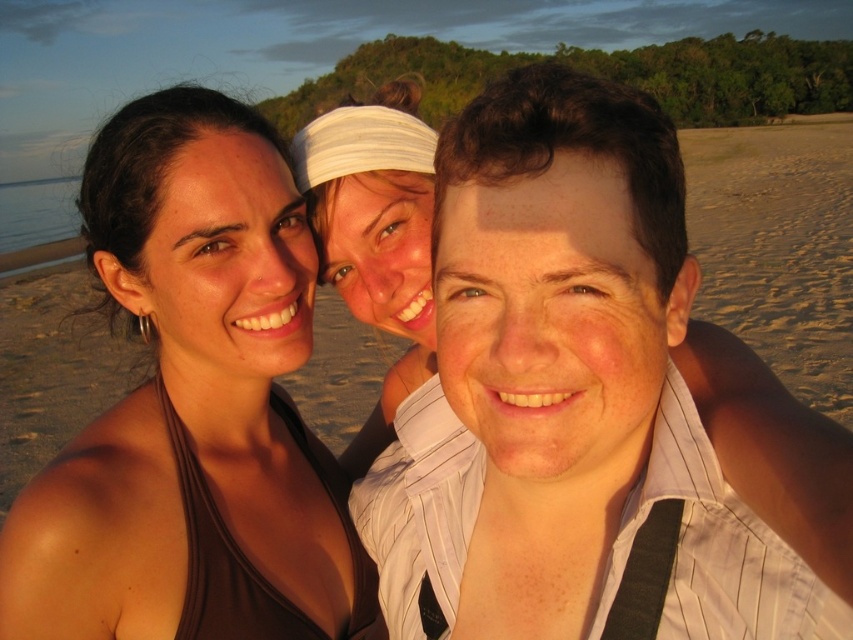
Question: Is brown fabric top at left positioned in front of white fabric headband at center?

Choices:
 (A) no
 (B) yes

Answer: (B)

Question: Is brown fabric top at left below white fabric headband at center?

Choices:
 (A) yes
 (B) no

Answer: (A)

Question: Which of the following is the farthest from the observer?

Choices:
 (A) (263, 572)
 (B) (392, 83)

Answer: (B)

Question: Is brown fabric top at left closer to the viewer compared to white fabric headband at center?

Choices:
 (A) no
 (B) yes

Answer: (B)

Question: Which point is closer to the camera?

Choices:
 (A) brown fabric top at left
 (B) white fabric headband at center

Answer: (A)